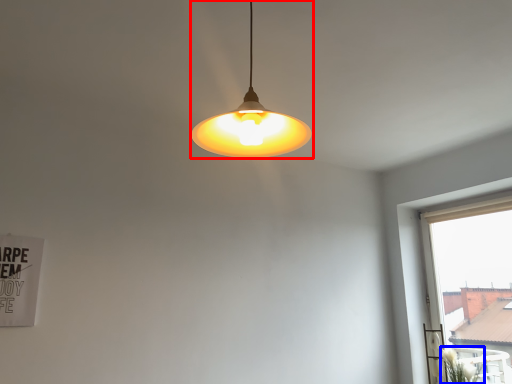
Question: Among these objects, which one is farthest to the camera, lamp (highlighted by a red box) or plant (highlighted by a blue box)?

Choices:
 (A) lamp
 (B) plant

Answer: (B)